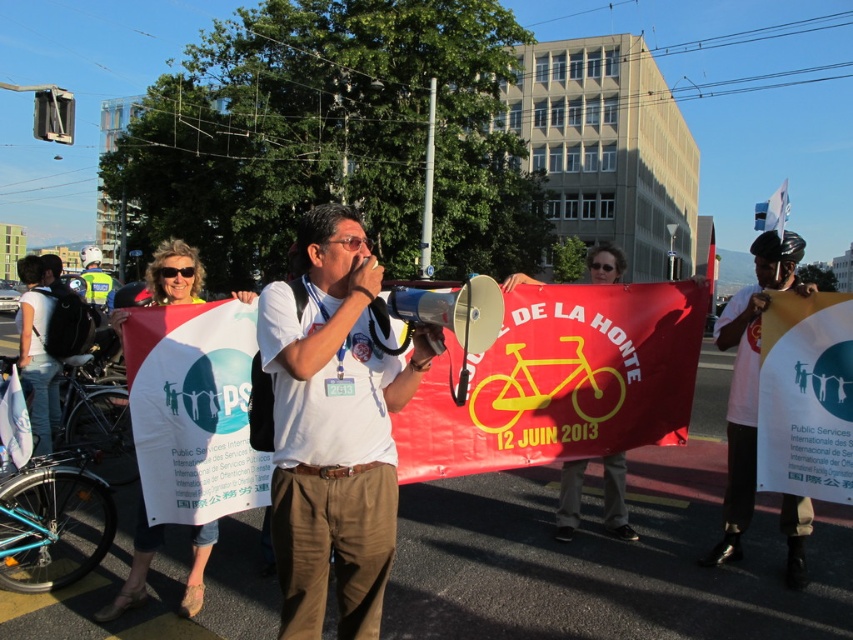
Is white paper sign at center below yellow paper banner at center?

Yes.

Which is behind, point (801, 550) or point (607, 250)?

The point (607, 250) is more distant.

Image resolution: width=853 pixels, height=640 pixels. What do you see at coordinates (749, 378) in the screenshot? I see `white paper sign at center` at bounding box center [749, 378].

At what (x,y) coordinates should I click in order to perform the action: click on white paper sign at center. Please return your answer as a coordinate pair (x, y). Looking at the image, I should click on (749, 378).

Does white cotton shirt at center appear over white paper banner at center?

Actually, white cotton shirt at center is below white paper banner at center.

Which of these two, white cotton shirt at center or white paper banner at center, stands taller?

white cotton shirt at center is taller.

Where is `white cotton shirt at center`? The width and height of the screenshot is (853, 640). white cotton shirt at center is located at coordinates (334, 428).

Does white paper banner at center appear on the left side of white fabric banner at center?

Incorrect, white paper banner at center is not on the left side of white fabric banner at center.

Between point (837, 339) and point (189, 605), which one is positioned behind?

The point (837, 339) is behind.

Locate an element on the screen. white paper banner at center is located at coordinates (805, 396).

Find the location of a particular element. The width and height of the screenshot is (853, 640). white paper banner at center is located at coordinates (805, 396).